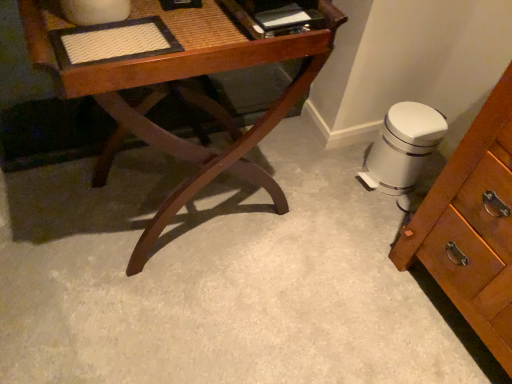
What are the coordinates of `free space between glossy wood desk at center and white glossy trash can at lower right` in the screenshot? It's located at (308, 177).